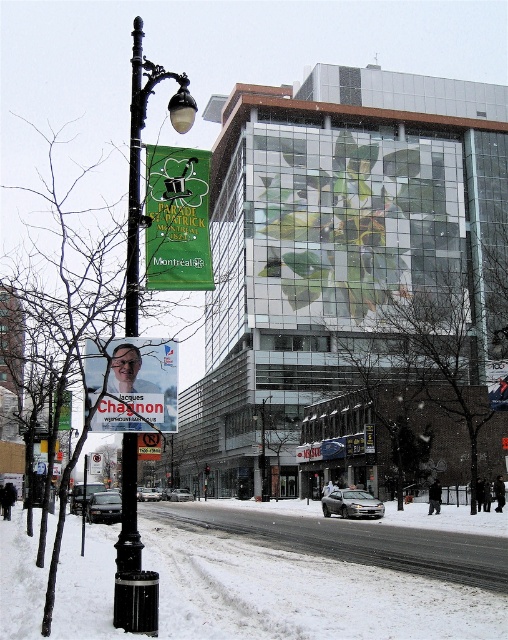
Question: Is snowy asphalt road at lower center below green fabric banner at upper left?

Choices:
 (A) yes
 (B) no

Answer: (A)

Question: Which of these objects is positioned closest to the snowy asphalt road at lower center?

Choices:
 (A) matte plastic poster at center
 (B) white snow at lower left

Answer: (B)

Question: Among these points, which one is farthest from the camera?

Choices:
 (A) (136, 404)
 (B) (174, 237)
 (C) (359, 561)
 (D) (391, 636)

Answer: (C)

Question: Does white snow at lower left appear over matte plastic poster at center?

Choices:
 (A) no
 (B) yes

Answer: (A)

Question: Is white snow at lower left positioned before snowy asphalt road at lower center?

Choices:
 (A) yes
 (B) no

Answer: (A)

Question: Which object is the farthest from the black metal streetlamp at left?

Choices:
 (A) matte plastic poster at center
 (B) white snow at lower left
 (C) snowy asphalt road at lower center

Answer: (C)